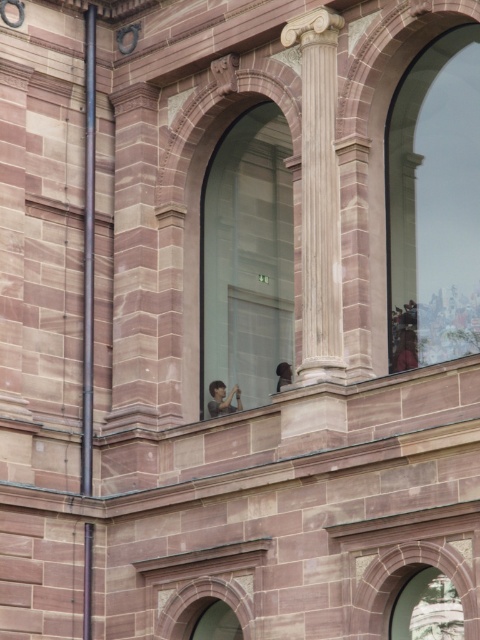
The image size is (480, 640). Describe the element at coordinates (247, 257) in the screenshot. I see `transparent glass window at center` at that location.

Is point (261, 304) positioned after point (286, 381)?

Yes, it is.

Find the location of a particular element. The image size is (480, 640). transparent glass window at center is located at coordinates (247, 257).

Who is taller, transparent glass window at center or smooth skin face at center?

transparent glass window at center is taller.

From the picture: Does transparent glass window at center appear on the left side of smooth skin face at center?

In fact, transparent glass window at center is to the right of smooth skin face at center.

Find the location of a particular element. transparent glass window at center is located at coordinates (247, 257).

Between point (340, 362) and point (216, 416), which one is positioned behind?

Positioned behind is point (216, 416).

Can you confirm if polished stone column at center is shorter than smooth skin face at center?

Incorrect, polished stone column at center's height does not fall short of smooth skin face at center's.

This screenshot has width=480, height=640. Identify the location of polished stone column at center. (319, 196).